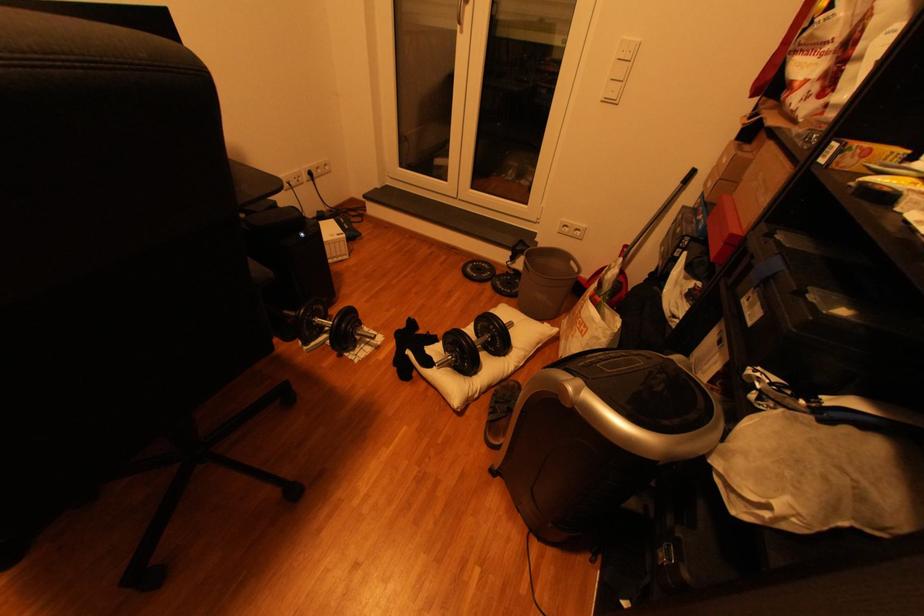
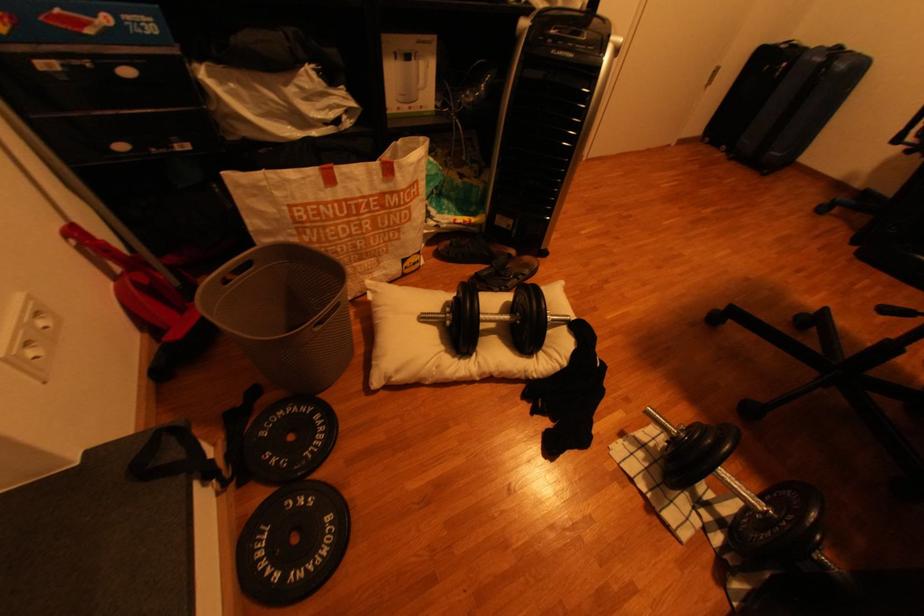
In the second image, find the point that corresponds to (x=520, y=325) in the first image.

(433, 318)